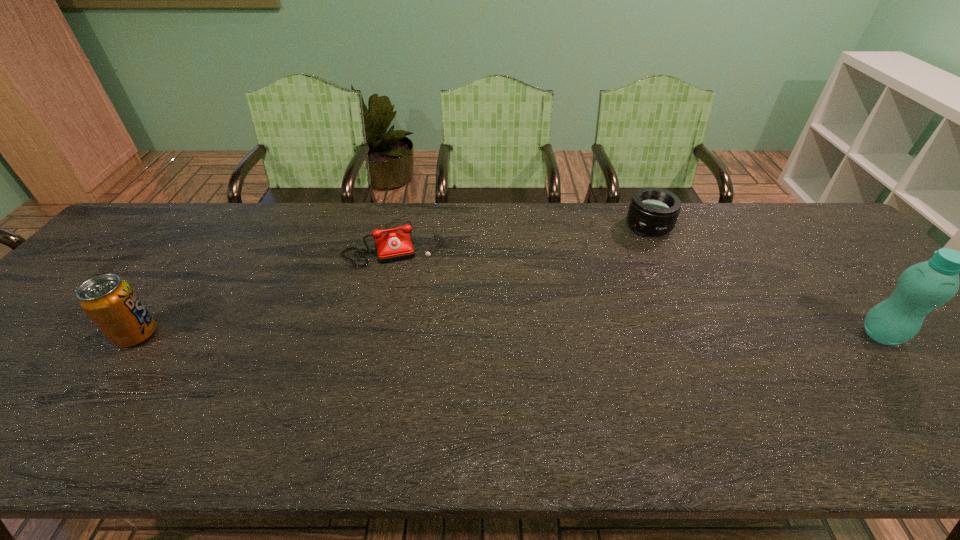
This screenshot has height=540, width=960. I want to click on object that ranks as the closest to the soda can, so click(392, 246).

Identify the location of the closest object to the leftmost object. The height and width of the screenshot is (540, 960). (392, 246).

Find the location of a particular element. vacant space that satisfies the following two spatial constraints: 1. on the back side of the soda can; 2. on the left side of the telephone is located at coordinates pos(203,243).

The width and height of the screenshot is (960, 540). I want to click on free point that satisfies the following two spatial constraints: 1. on the front side of the tallest object; 2. on the right side of the telephoto lens, so click(x=700, y=335).